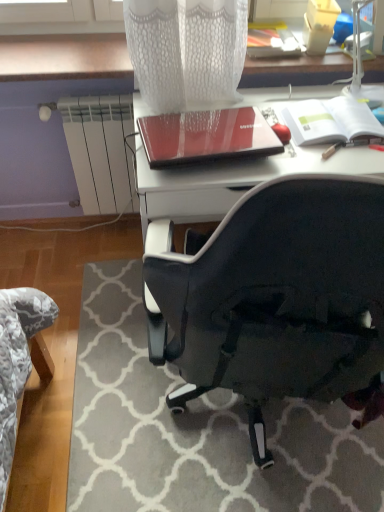
Question: Is white mesh table lamp at upper right aimed at white matte notebook at upper right, the 1th notebook from the right?

Choices:
 (A) yes
 (B) no

Answer: (B)

Question: Would you say white mesh table lamp at upper right is outside white matte notebook at upper right, the 1th notebook from the right?

Choices:
 (A) yes
 (B) no

Answer: (A)

Question: Is white mesh table lamp at upper right touching white matte notebook at upper right, the 2th notebook in the left-to-right sequence?

Choices:
 (A) yes
 (B) no

Answer: (B)

Question: From the image's perspective, is white mesh table lamp at upper right located beneath white matte notebook at upper right, the 2th notebook in the left-to-right sequence?

Choices:
 (A) yes
 (B) no

Answer: (B)

Question: Considering the relative positions of white mesh table lamp at upper right and white matte notebook at upper right, the 2th notebook in the left-to-right sequence, in the image provided, is white mesh table lamp at upper right behind white matte notebook at upper right, the 2th notebook in the left-to-right sequence,?

Choices:
 (A) no
 (B) yes

Answer: (A)

Question: Considering the relative sizes of white mesh table lamp at upper right and white matte notebook at upper right, the 1th notebook from the right, in the image provided, is white mesh table lamp at upper right wider than white matte notebook at upper right, the 1th notebook from the right,?

Choices:
 (A) no
 (B) yes

Answer: (A)

Question: Does black fabric chair at lower right have a greater width compared to white mesh table lamp at upper right?

Choices:
 (A) no
 (B) yes

Answer: (B)

Question: From a real-world perspective, is black fabric chair at lower right physically above white mesh table lamp at upper right?

Choices:
 (A) yes
 (B) no

Answer: (B)

Question: Is black fabric chair at lower right in front of white mesh table lamp at upper right?

Choices:
 (A) no
 (B) yes

Answer: (B)

Question: Is white mesh table lamp at upper right surrounded by black fabric chair at lower right?

Choices:
 (A) no
 (B) yes

Answer: (A)

Question: Does black fabric chair at lower right have a larger size compared to white mesh table lamp at upper right?

Choices:
 (A) no
 (B) yes

Answer: (B)

Question: Are black fabric chair at lower right and white mesh table lamp at upper right beside each other?

Choices:
 (A) no
 (B) yes

Answer: (A)

Question: Is white matte notebook at upper right, the 2th notebook in the left-to-right sequence, surrounding white mesh table lamp at upper right?

Choices:
 (A) no
 (B) yes

Answer: (A)